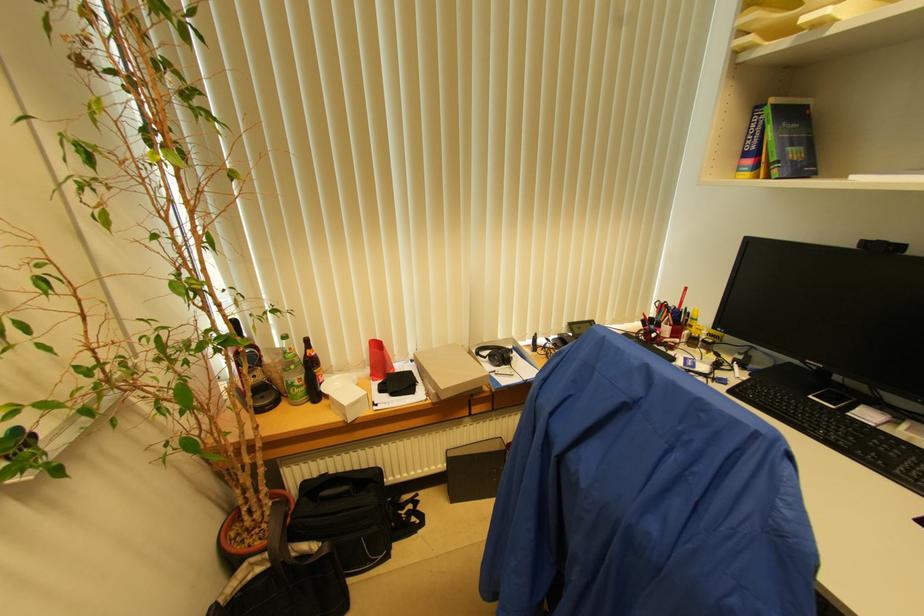
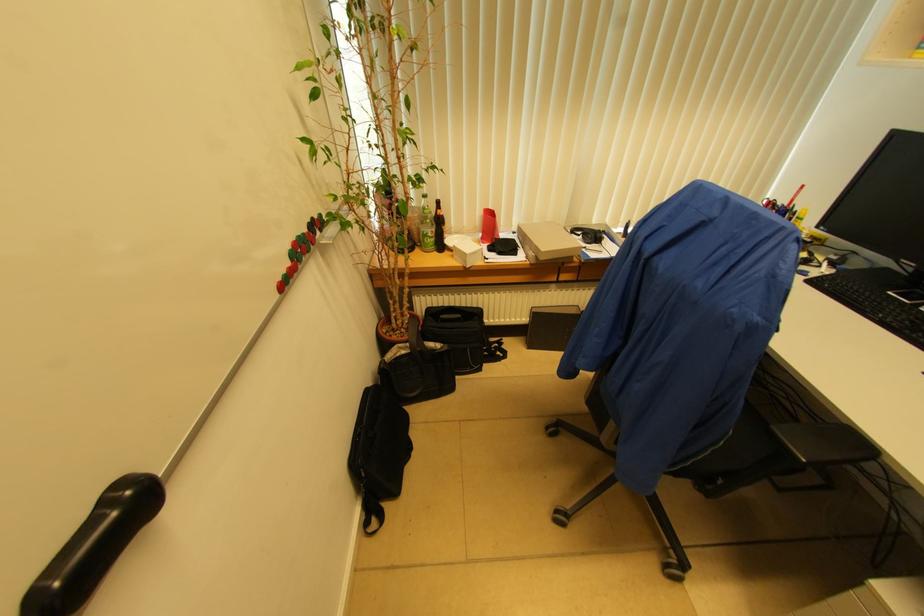
Where in the second image is the point corresponding to pixel 444 389 from the first image?

(543, 252)